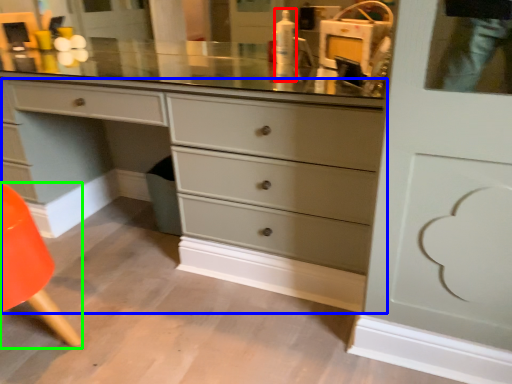
Question: Based on their relative distances, which object is farther from toiletry (highlighted by a red box)? Choose from chest of drawers (highlighted by a blue box) and armchair (highlighted by a green box).

Choices:
 (A) chest of drawers
 (B) armchair

Answer: (B)